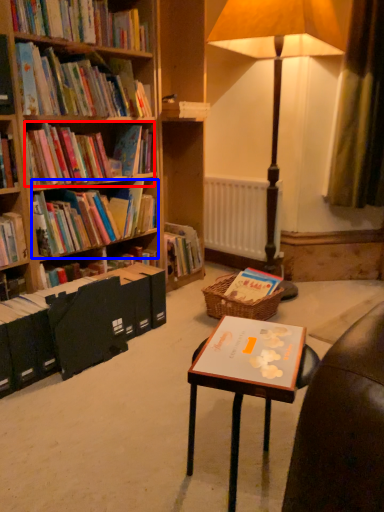
Question: Which object appears farthest to the camera in this image, book (highlighted by a red box) or book (highlighted by a blue box)?

Choices:
 (A) book
 (B) book

Answer: (B)